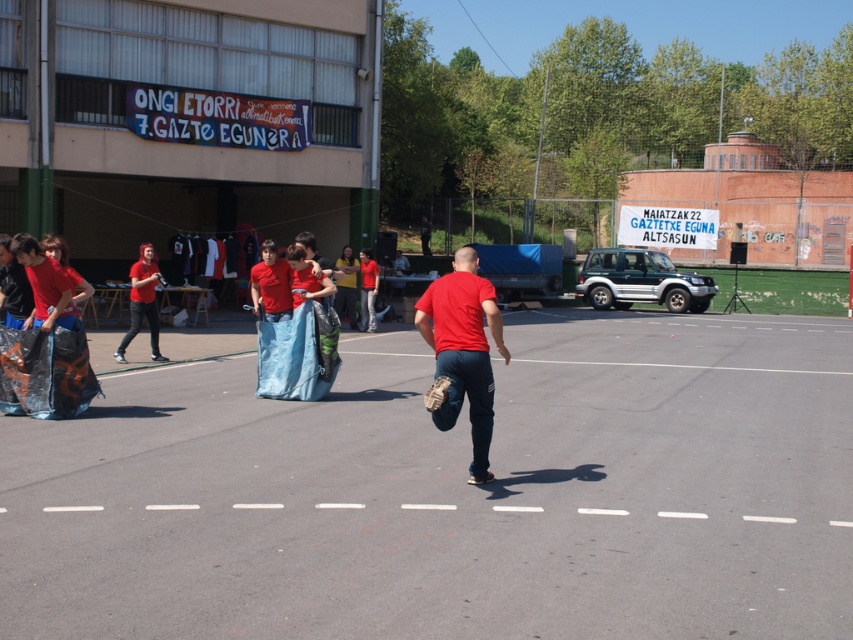
Question: Is matte red shirt at center to the right of matte red shirt at left from the viewer's perspective?

Choices:
 (A) yes
 (B) no

Answer: (A)

Question: Is matte red shirt at center below matte red shirt at left?

Choices:
 (A) no
 (B) yes

Answer: (B)

Question: Among these objects, which one is nearest to the camera?

Choices:
 (A) matte red shirt at left
 (B) matte red shirt at center

Answer: (B)

Question: Can you confirm if matte red shirt at center is positioned below matte red shirt at left?

Choices:
 (A) no
 (B) yes

Answer: (B)